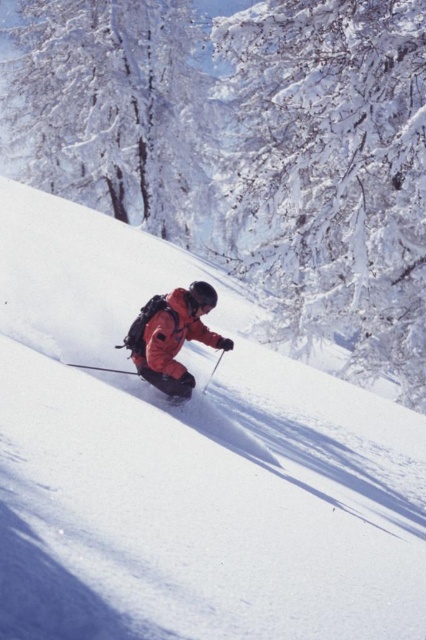
You are standing at the base of the slope and want to reach the point marked as point (120, 291). If you start moving straight towards it, how far will you have to walk?

The point (120, 291) is 46.53 feet from the viewer, so you will have to walk 46.53 feet to reach it.

You are a photographer standing at the bottom of the slope. You want to take a photo of the orange softshell jacket at center and the matte orange ski slope at center. Which object should you focus on first if you want to capture both in the same frame without moving the camera?

The matte orange ski slope at center is to the left of the orange softshell jacket at center, so you should focus on the orange softshell jacket at center first as it is closer to the camera, ensuring both objects are in the frame.